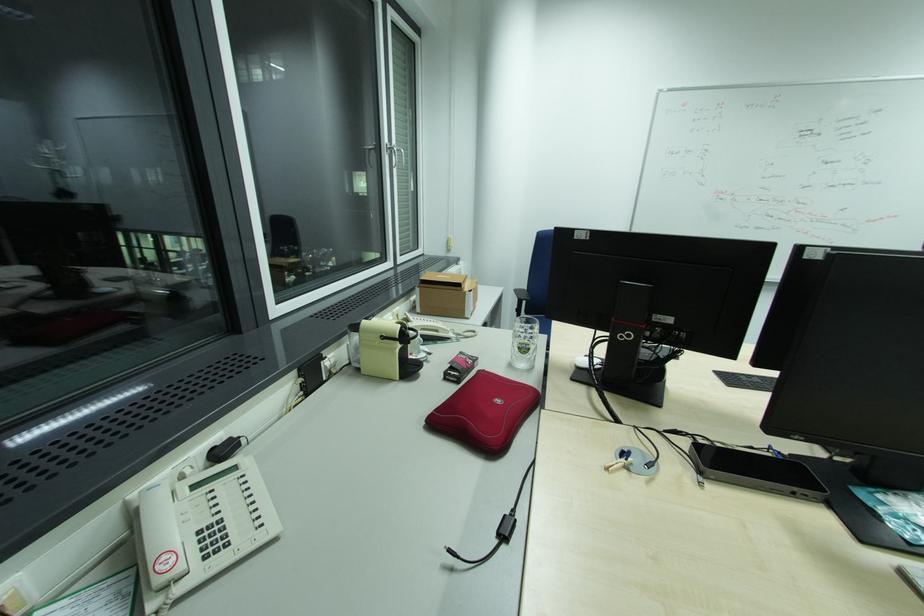
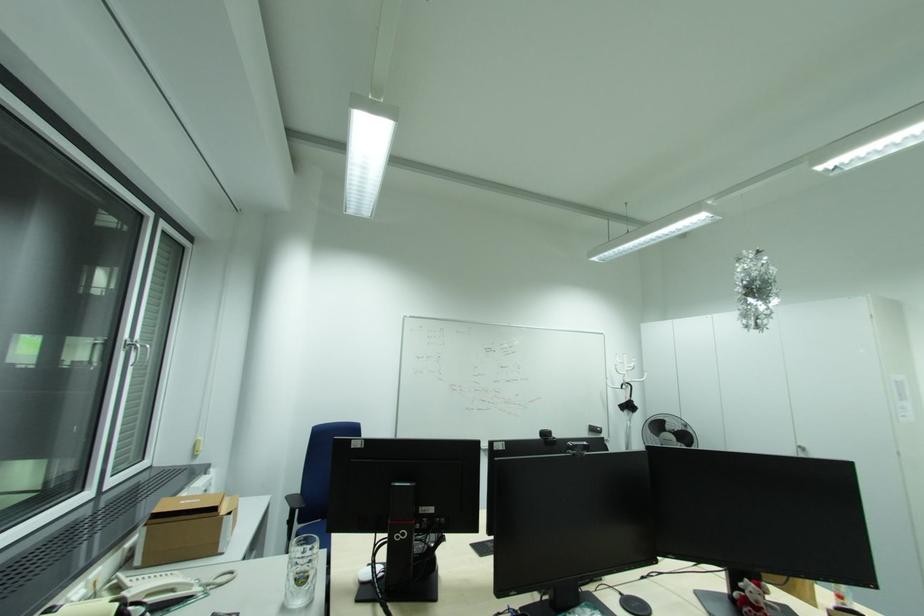
Based on the continuous images, in which direction is the camera rotating?

The camera rotated toward right-up.